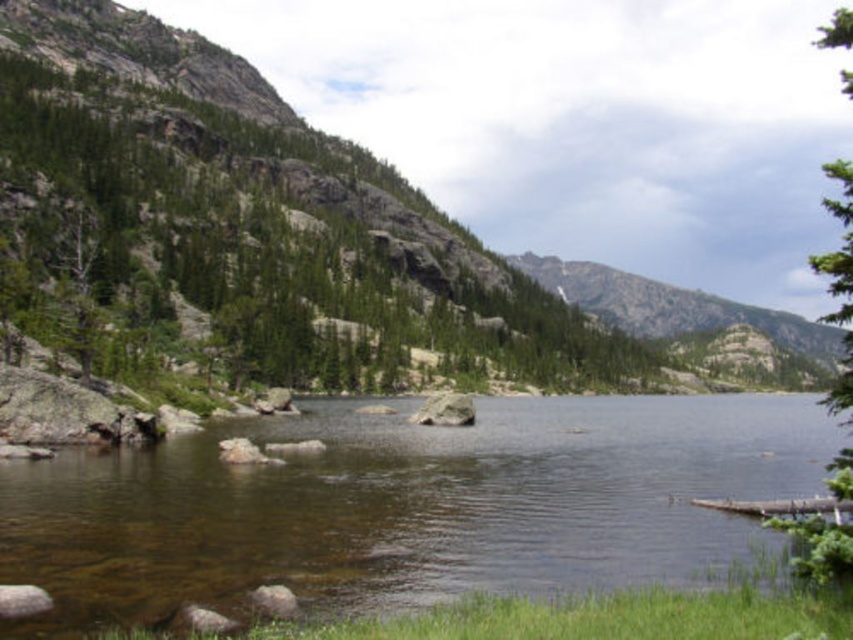
You are a hiker trying to cross the lake. You see the green textured tree at right and the smooth gray rock at center. Which object can you use as a stepping stone?

The smooth gray rock at center can be used as a stepping stone since it is smaller and positioned at the center of the lake, making it more accessible for crossing. The green textured tree at right is larger and located on the shore, so it is not suitable for stepping.

You are standing at the lakeshore and want to take a photo of the rocky gray mountain at center and the green textured tree at right. Which object should you frame first in your camera viewfinder to ensure both are in the shot?

You should frame the green textured tree at right first because the rocky gray mountain at center is positioned to the right of the green textured tree at right, so by starting with the tree, you can adjust the viewfinder to include both objects.

Based on the photo, you are standing on the shore of the lake and want to take a photo of the rocky gray mountain at center. To get the best reflection shot, where should you position yourself in relation to the clear water at center?

You should position yourself at the clear water at center because it is under the rocky gray mountain at center, which means the water there is likely reflecting the mountain, providing the best reflection for your photo.